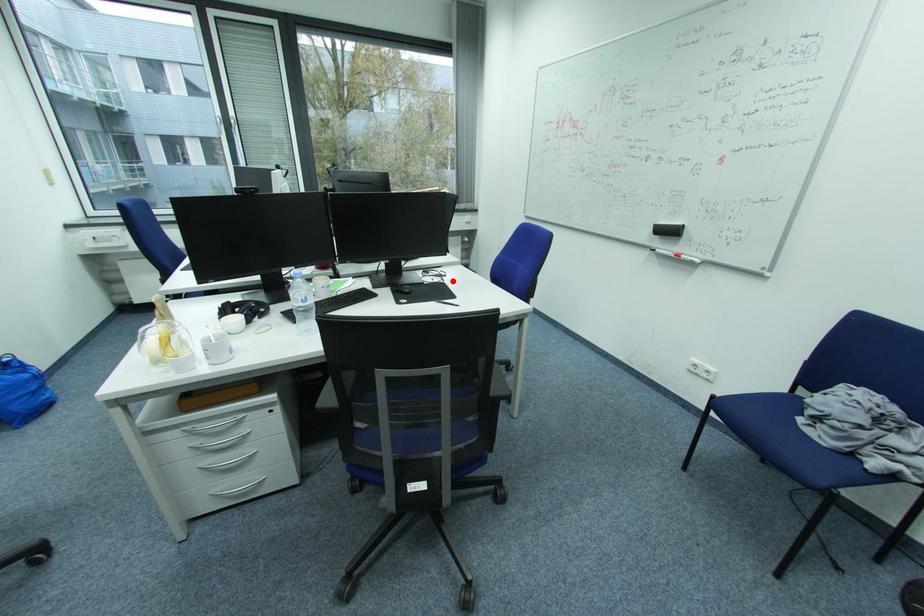
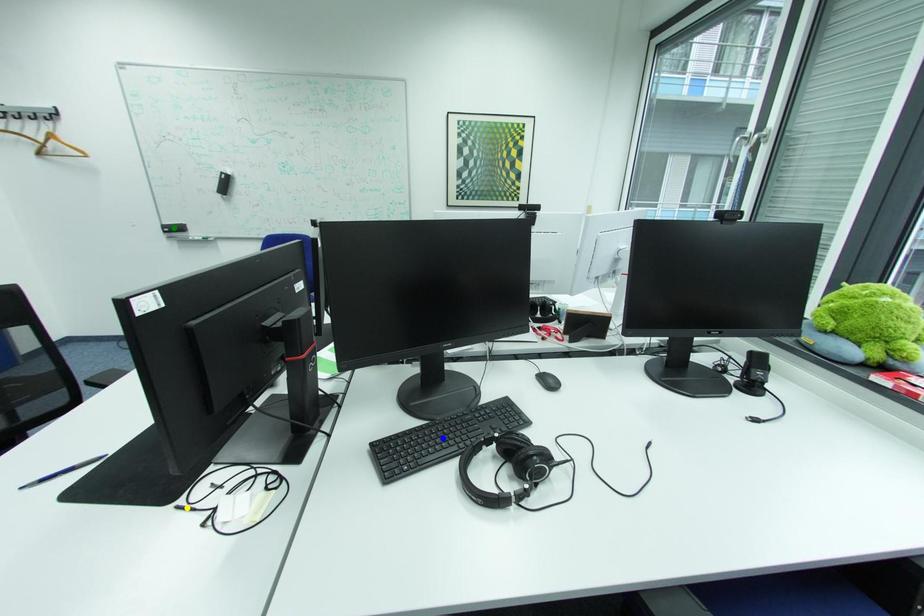
Question: I am providing you with two images of the same scene from different viewpoints. A red point is marked on the first image. You are given multiple points on the second image. Which mark in image 2 goes with the point in image 1?

Choices:
 (A) blue point
 (B) yellow point
 (C) green point

Answer: (B)